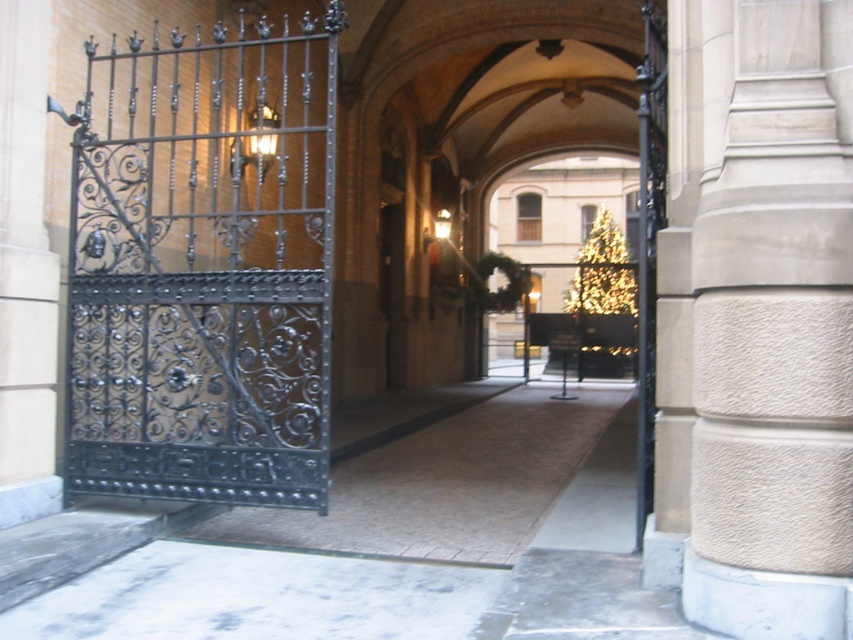
Measure the distance from black wrought iron gate at left to smooth stone column at center.

The distance of black wrought iron gate at left from smooth stone column at center is 27.06 feet.

Who is shorter, black wrought iron gate at left or smooth stone column at center?

Standing shorter between the two is black wrought iron gate at left.

Describe the element at coordinates (202, 266) in the screenshot. Image resolution: width=853 pixels, height=640 pixels. I see `black wrought iron gate at left` at that location.

This screenshot has width=853, height=640. I want to click on black wrought iron gate at left, so click(202, 266).